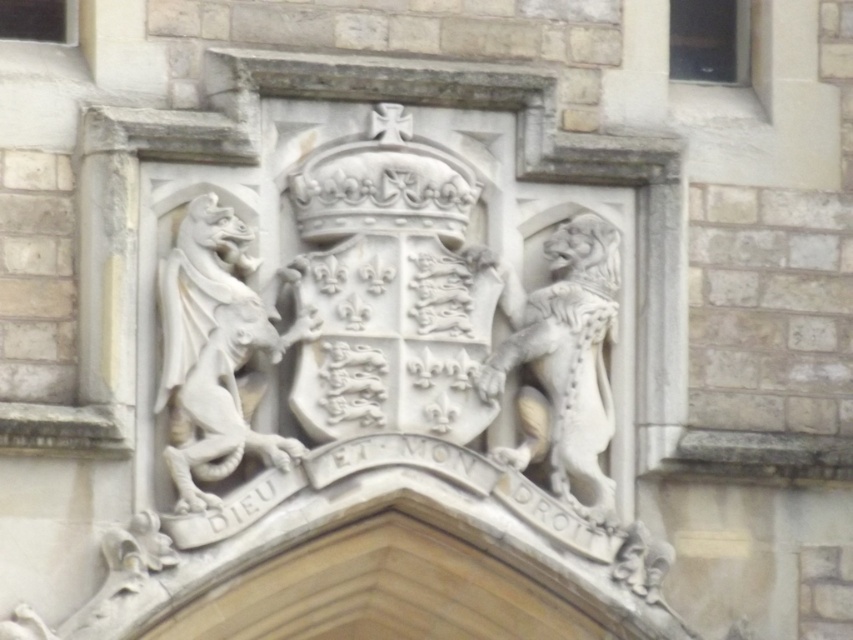
Question: Can you confirm if white stone gargoyle at upper left is bigger than white stone lion at right?

Choices:
 (A) no
 (B) yes

Answer: (A)

Question: Is white stone gargoyle at upper left bigger than white stone lion at right?

Choices:
 (A) no
 (B) yes

Answer: (A)

Question: Which point is farther to the camera?

Choices:
 (A) white stone lion at right
 (B) white stone gargoyle at upper left

Answer: (A)

Question: Can you confirm if white stone gargoyle at upper left is smaller than white stone lion at right?

Choices:
 (A) yes
 (B) no

Answer: (A)